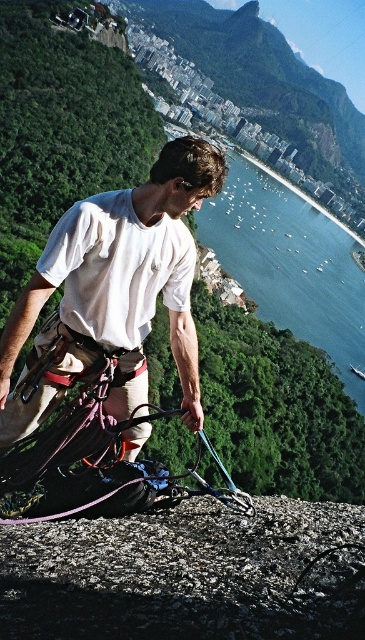
Question: Which of the following is the closest to the observer?

Choices:
 (A) (240, 193)
 (B) (74, 552)

Answer: (B)

Question: Which point is closer to the camera?

Choices:
 (A) (309, 228)
 (B) (51, 598)

Answer: (B)

Question: Which point is farther to the camera?

Choices:
 (A) (252, 212)
 (B) (100, 532)

Answer: (A)

Question: Is smooth gray rock at center to the right of blue water at center from the viewer's perspective?

Choices:
 (A) no
 (B) yes

Answer: (A)

Question: In this image, where is smooth gray rock at center located relative to blue water at center?

Choices:
 (A) right
 (B) left

Answer: (B)

Question: Observing the image, what is the correct spatial positioning of smooth gray rock at center in reference to blue water at center?

Choices:
 (A) right
 (B) left

Answer: (B)